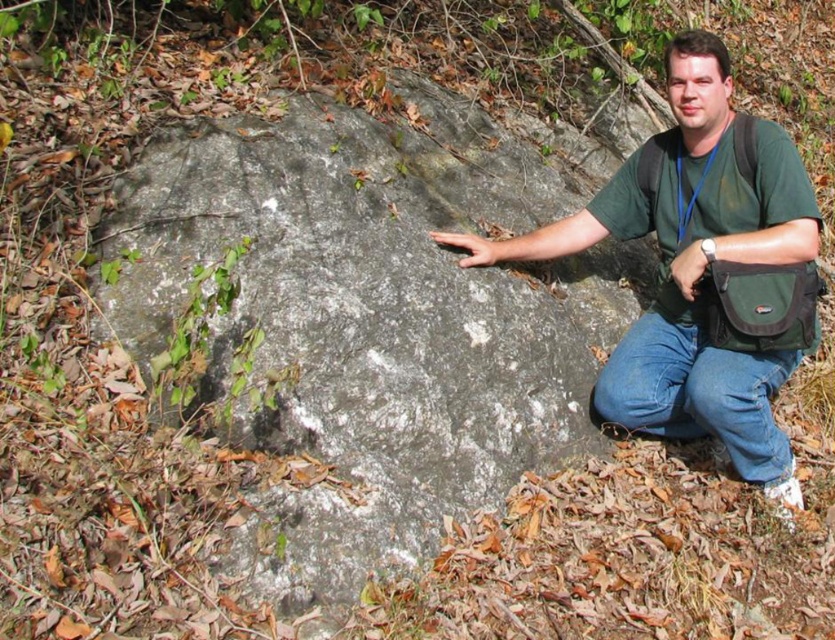
You are planning to take a photo of the gray rough rock at center and the green fabric bag at center. Which object should you focus on first if you want to capture both in a single frame without moving your camera?

The gray rough rock at center is bigger than the green fabric bag at center, so you should focus on the gray rough rock at center first to ensure it fits properly in the frame before adjusting for the smaller green fabric bag at center.

You are a hiker who wants to take a photo of the gray rough rock at center and the green fabric bag at center. Since you have a camera with a fixed focal length, you need to know which object is taller. Can you determine which one is taller?

The gray rough rock at center is taller than the green fabric bag at center, so you should adjust your camera settings to capture the full height of the rock.

You are a hiker who wants to take a photo of the gray rough rock at center and the smooth gray rock at center. Which rock should you stand closer to if you want to capture both in your camera frame?

You should stand closer to the smooth gray rock at center because the gray rough rock at center is to the right of it, so positioning yourself near the smoother one will help include both rocks within the camera frame.